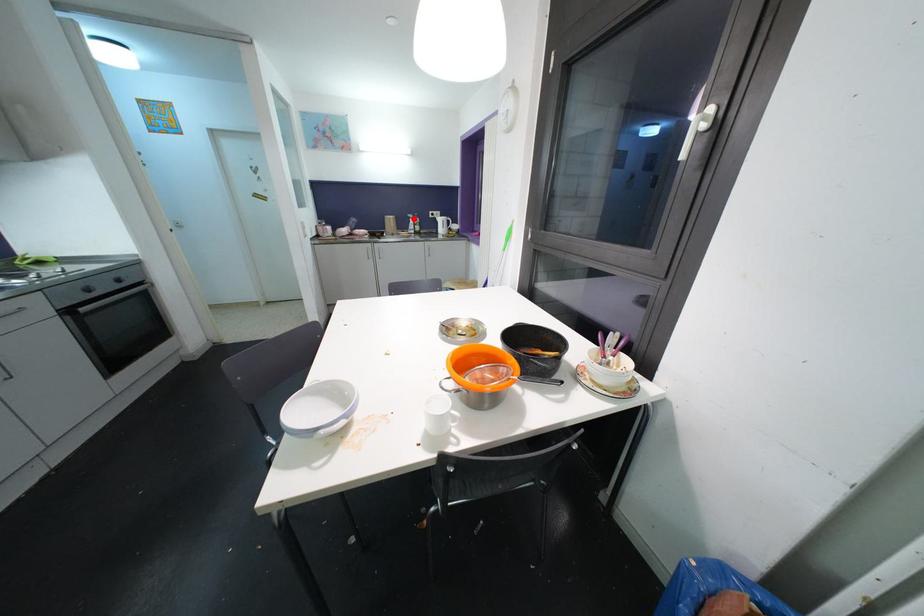
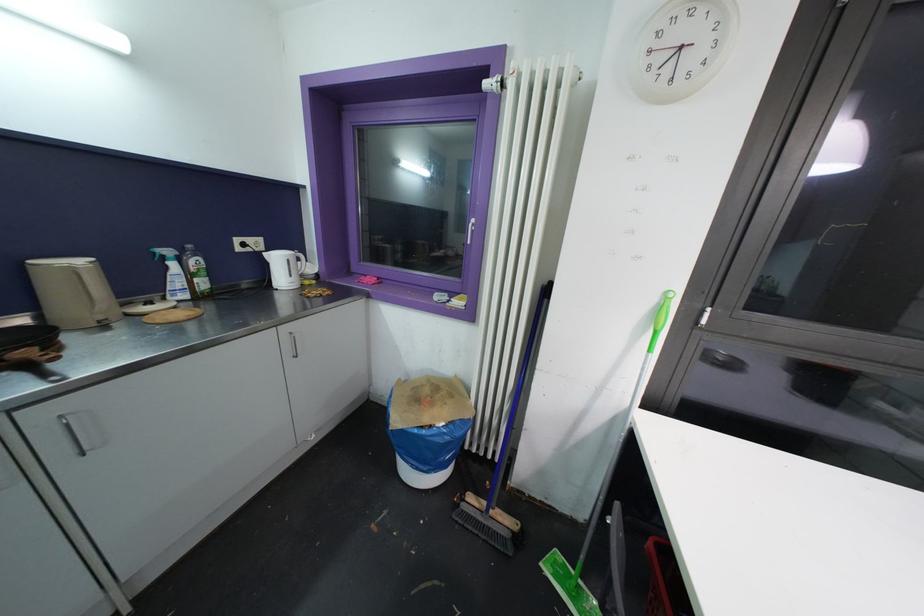
Question: A red point is marked in image1. In image2, is the corresponding 3D point closer to the camera or farther? Reply with the corresponding letter.

Choices:
 (A) The corresponding 3D point is closer.
 (B) The corresponding 3D point is farther.

Answer: (B)